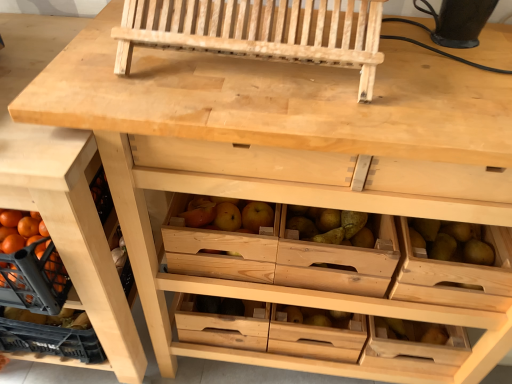
Question: Is natural wood drawer at lower left at the back of wooden drawer at center, positioned as the second drawer in top-to-bottom order?

Choices:
 (A) yes
 (B) no

Answer: (B)

Question: Can you confirm if wooden drawer at center, which is the first drawer in bottom-to-top order, is positioned to the right of natural wood drawer at lower left?

Choices:
 (A) yes
 (B) no

Answer: (A)

Question: From the image's perspective, is wooden drawer at center, arranged as the first drawer when viewed from the back, beneath natural wood drawer at lower left?

Choices:
 (A) no
 (B) yes

Answer: (B)

Question: From a real-world perspective, is wooden drawer at center, positioned as the second drawer in top-to-bottom order, positioned over natural wood drawer at lower left based on gravity?

Choices:
 (A) yes
 (B) no

Answer: (B)

Question: Is wooden drawer at center, positioned as the second drawer in top-to-bottom order, bigger than natural wood drawer at lower left?

Choices:
 (A) yes
 (B) no

Answer: (B)

Question: From the image's perspective, is wooden drawer at center, which is the first drawer in bottom-to-top order, on top of natural wood drawer at lower left?

Choices:
 (A) no
 (B) yes

Answer: (A)

Question: Is natural wood church bench at upper center touching wooden drawer at right, which ranks as the 1th drawer in right-to-left order?

Choices:
 (A) no
 (B) yes

Answer: (A)

Question: Does natural wood church bench at upper center have a lesser height compared to wooden drawer at right, acting as the second drawer starting from the back?

Choices:
 (A) yes
 (B) no

Answer: (B)

Question: Does natural wood church bench at upper center have a lesser width compared to wooden drawer at right, the second drawer when ordered from bottom to top?

Choices:
 (A) yes
 (B) no

Answer: (B)

Question: Does natural wood church bench at upper center lie behind wooden drawer at right, the second drawer viewed from the left?

Choices:
 (A) no
 (B) yes

Answer: (A)

Question: From a real-world perspective, is natural wood church bench at upper center positioned over wooden drawer at right, which appears as the first drawer when viewed from the top, based on gravity?

Choices:
 (A) no
 (B) yes

Answer: (B)

Question: Is natural wood church bench at upper center positioned before wooden drawer at right, acting as the second drawer starting from the back?

Choices:
 (A) no
 (B) yes

Answer: (B)

Question: Considering the relative positions of natural wood church bench at upper center and wooden drawer at center, the second drawer in the front-to-back sequence, in the image provided, is natural wood church bench at upper center to the left of wooden drawer at center, the second drawer in the front-to-back sequence, from the viewer's perspective?

Choices:
 (A) yes
 (B) no

Answer: (A)